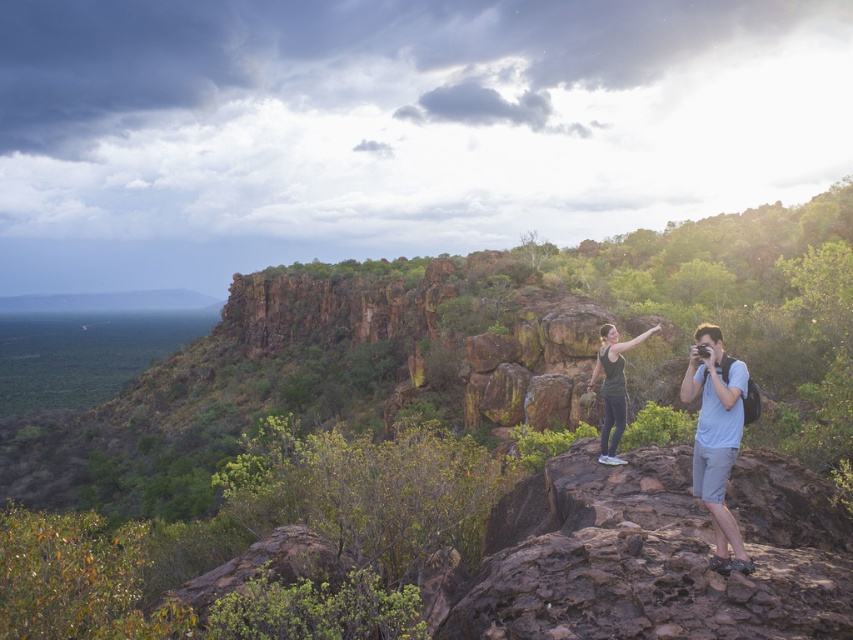
Question: Does rustic rock formation at center come in front of black matte tank top at center?

Choices:
 (A) yes
 (B) no

Answer: (A)

Question: Does light blue fabric camera at right have a larger size compared to black matte tank top at center?

Choices:
 (A) yes
 (B) no

Answer: (B)

Question: Which of the following is the closest to the observer?

Choices:
 (A) light blue fabric camera at right
 (B) rustic rock formation at center

Answer: (B)

Question: Which object appears closest to the camera in this image?

Choices:
 (A) light blue fabric camera at right
 (B) rustic rock formation at center
 (C) black matte tank top at center
 (D) matte black tank top at center

Answer: (B)

Question: Is matte black tank top at center below black matte tank top at center?

Choices:
 (A) yes
 (B) no

Answer: (A)

Question: Among these objects, which one is nearest to the camera?

Choices:
 (A) light blue fabric camera at right
 (B) black matte tank top at center
 (C) rustic rock formation at center
 (D) matte black tank top at center

Answer: (C)